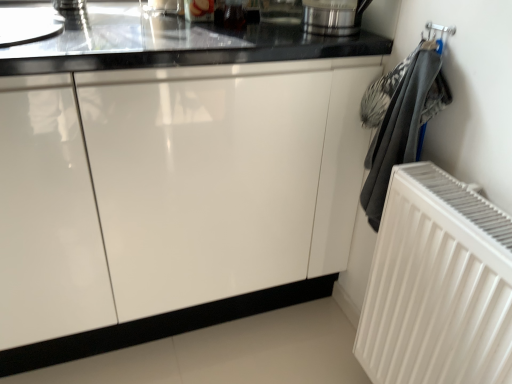
Question: Would you consider white ribbed radiator at right to be distant from polished stainless steel kettle at upper right?

Choices:
 (A) no
 (B) yes

Answer: (A)

Question: From the image's perspective, would you say white ribbed radiator at right is shown under polished stainless steel kettle at upper right?

Choices:
 (A) yes
 (B) no

Answer: (A)

Question: Does white ribbed radiator at right have a greater height compared to polished stainless steel kettle at upper right?

Choices:
 (A) yes
 (B) no

Answer: (A)

Question: Is white ribbed radiator at right surrounding polished stainless steel kettle at upper right?

Choices:
 (A) no
 (B) yes

Answer: (A)

Question: Can you confirm if white ribbed radiator at right is smaller than polished stainless steel kettle at upper right?

Choices:
 (A) yes
 (B) no

Answer: (B)

Question: Based on their positions, is polished stainless steel kettle at upper right located to the left or right of glossy white cabinet at center?

Choices:
 (A) left
 (B) right

Answer: (B)

Question: Based on their sizes in the image, would you say polished stainless steel kettle at upper right is bigger or smaller than glossy white cabinet at center?

Choices:
 (A) small
 (B) big

Answer: (A)

Question: From the image's perspective, is polished stainless steel kettle at upper right positioned above or below glossy white cabinet at center?

Choices:
 (A) above
 (B) below

Answer: (A)

Question: Considering the positions of polished stainless steel kettle at upper right and glossy white cabinet at center in the image, is polished stainless steel kettle at upper right wider or thinner than glossy white cabinet at center?

Choices:
 (A) thin
 (B) wide

Answer: (A)

Question: From a real-world perspective, is white ribbed radiator at right positioned above or below polished stainless steel kettle at upper right?

Choices:
 (A) below
 (B) above

Answer: (A)

Question: From the image's perspective, relative to polished stainless steel kettle at upper right, is white ribbed radiator at right above or below?

Choices:
 (A) above
 (B) below

Answer: (B)

Question: Looking at their shapes, would you say white ribbed radiator at right is wider or thinner than polished stainless steel kettle at upper right?

Choices:
 (A) wide
 (B) thin

Answer: (B)

Question: Is white ribbed radiator at right inside the boundaries of polished stainless steel kettle at upper right, or outside?

Choices:
 (A) outside
 (B) inside

Answer: (A)

Question: Considering the relative positions of white ribbed radiator at right and glossy white cabinet at center in the image provided, is white ribbed radiator at right to the left or to the right of glossy white cabinet at center?

Choices:
 (A) right
 (B) left

Answer: (A)

Question: From a real-world perspective, is white ribbed radiator at right positioned above or below glossy white cabinet at center?

Choices:
 (A) above
 (B) below

Answer: (B)